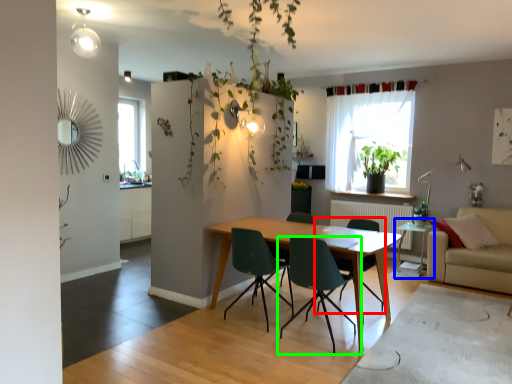
Question: Which object is the farthest from chair (highlighted by a red box)? Choose among these: side table (highlighted by a blue box) or chair (highlighted by a green box).

Choices:
 (A) side table
 (B) chair

Answer: (A)